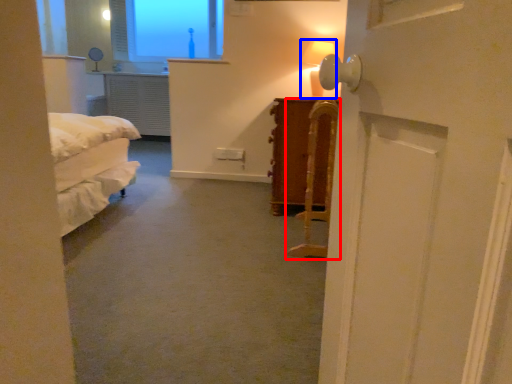
Question: Which object is closer to the camera taking this photo, furniture (highlighted by a red box) or table lamp (highlighted by a blue box)?

Choices:
 (A) furniture
 (B) table lamp

Answer: (A)